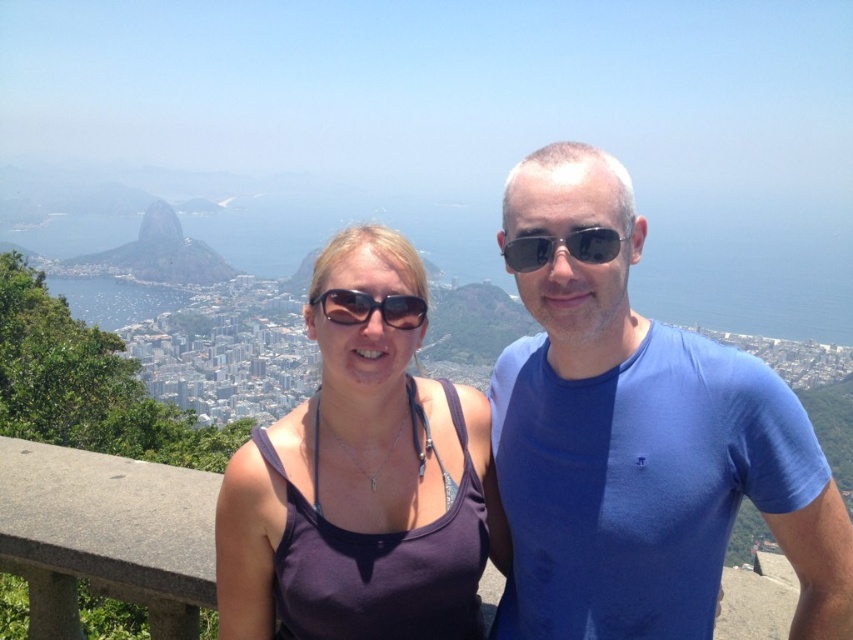
Question: Where is blue cotton t-shirt at center located in relation to green grassy hill at upper left in the image?

Choices:
 (A) left
 (B) right

Answer: (B)

Question: Does black plastic sunglasses at center have a lesser width compared to matte black sunglasses at center?

Choices:
 (A) no
 (B) yes

Answer: (A)

Question: Which point is farther to the camera?

Choices:
 (A) green grassy hill at upper left
 (B) matte black sunglasses at center
 (C) blue cotton t-shirt at center
 (D) purple fabric tank top at center

Answer: (A)

Question: Which is nearer to the green grassy hill at upper left?

Choices:
 (A) purple fabric tank top at center
 (B) black plastic sunglasses at center
 (C) blue cotton t-shirt at center
 (D) matte black sunglasses at center

Answer: (D)

Question: Among these objects, which one is nearest to the camera?

Choices:
 (A) green grassy hill at upper left
 (B) blue cotton t-shirt at center
 (C) matte black sunglasses at center
 (D) black plastic sunglasses at center

Answer: (B)

Question: Is blue cotton t-shirt at center positioned at the back of green grassy hill at upper left?

Choices:
 (A) yes
 (B) no

Answer: (B)